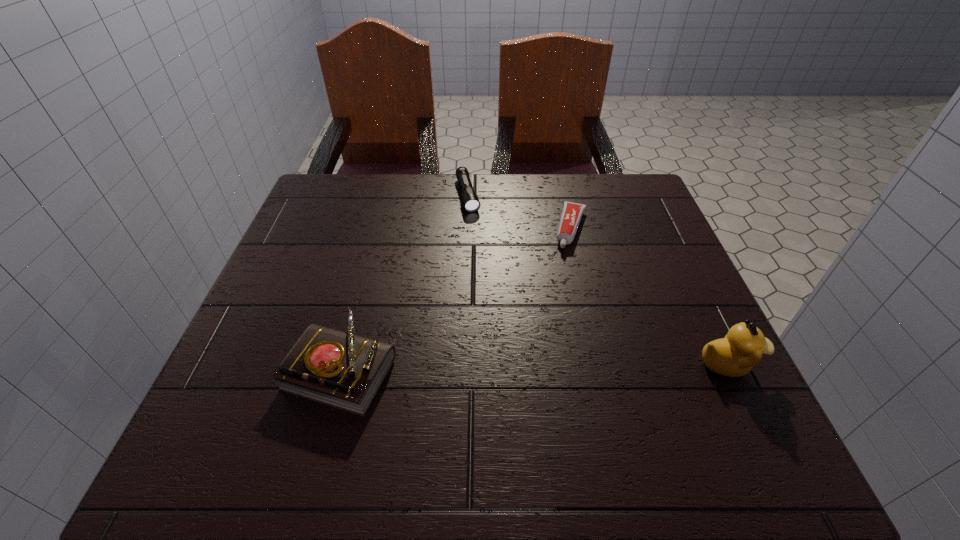
Identify the location of object located in the near left corner section of the desktop. The image size is (960, 540). (342, 370).

Identify the location of object that is at the near right corner. point(734,355).

Where is `vacant space at the far edge of the desktop`? vacant space at the far edge of the desktop is located at coordinates (443, 195).

Locate an element on the screen. The width and height of the screenshot is (960, 540). vacant space at the near edge is located at coordinates (399, 373).

The height and width of the screenshot is (540, 960). In order to click on free spot at the left edge of the desktop in this screenshot , I will do `click(339, 230)`.

I want to click on vacant region at the right edge of the desktop, so click(633, 238).

Image resolution: width=960 pixels, height=540 pixels. Identify the location of vacant space at the far left corner of the desktop. (346, 202).

This screenshot has width=960, height=540. In order to click on vacant space at the far right corner of the desktop in this screenshot , I will do `click(628, 204)`.

The height and width of the screenshot is (540, 960). I want to click on vacant region at the near right corner of the desktop, so click(714, 389).

Locate an element on the screen. Image resolution: width=960 pixels, height=540 pixels. free area in between the flashlight and the diary is located at coordinates (404, 281).